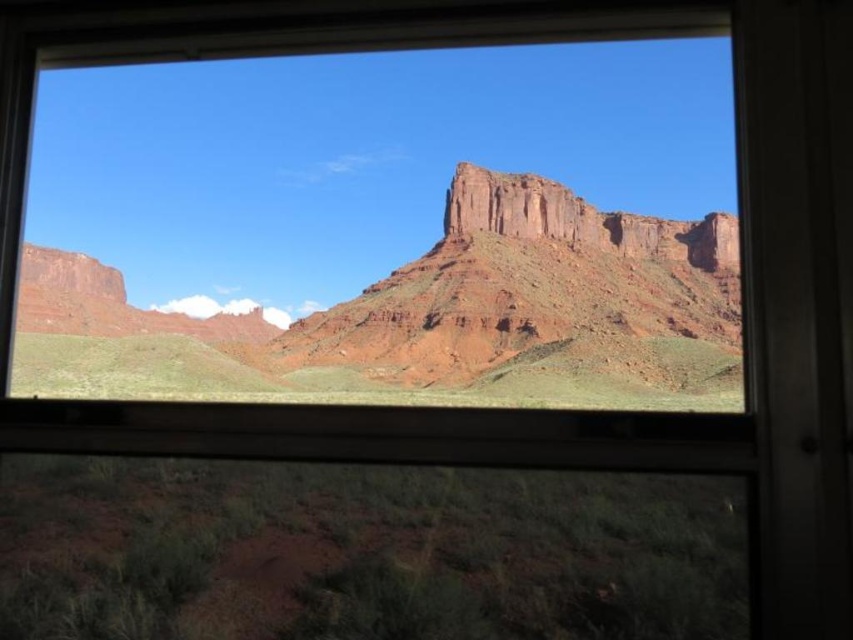
This screenshot has width=853, height=640. I want to click on rustic sandstone mountain at center, so click(x=428, y=317).

Between point (621, 285) and point (444, 228), which one is positioned behind?

The point (621, 285) is more distant.

Where is `rustic sandstone mountain at center`? rustic sandstone mountain at center is located at coordinates (428, 317).